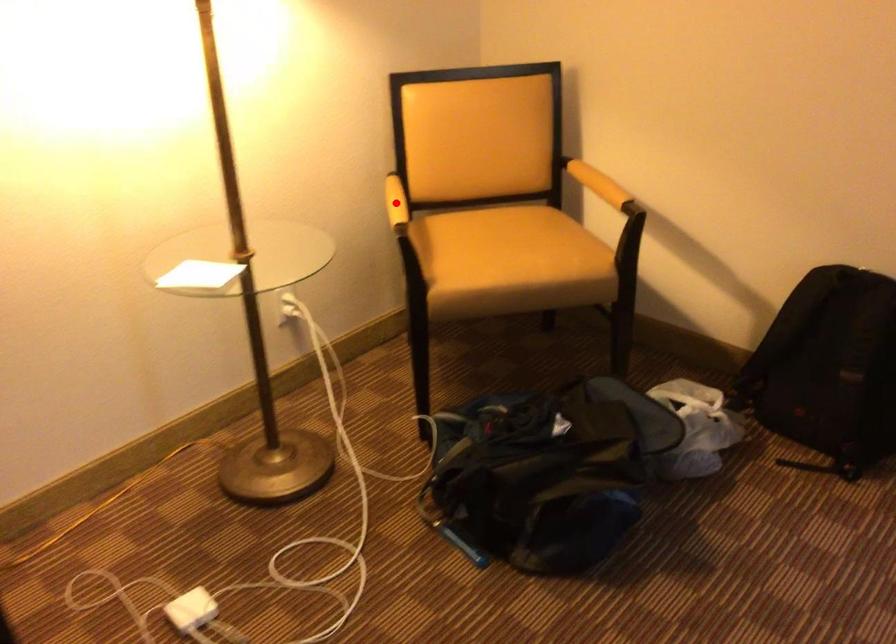
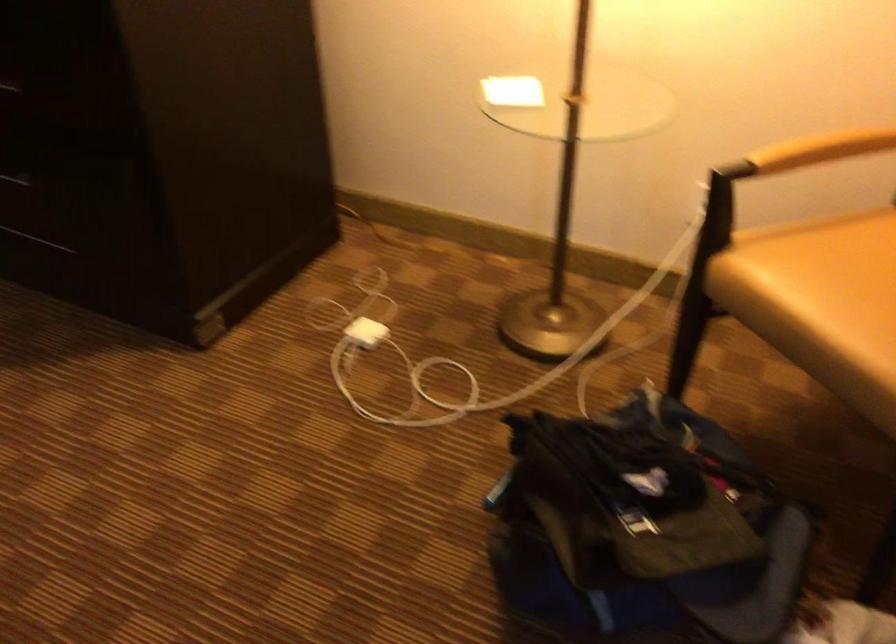
Question: I am providing you with two images of the same scene from different viewpoints. Image1 has a red point marked. In image2, the corresponding 3D location appears at what relative position? Reply with the corresponding letter.

Choices:
 (A) Closer
 (B) Farther

Answer: (A)